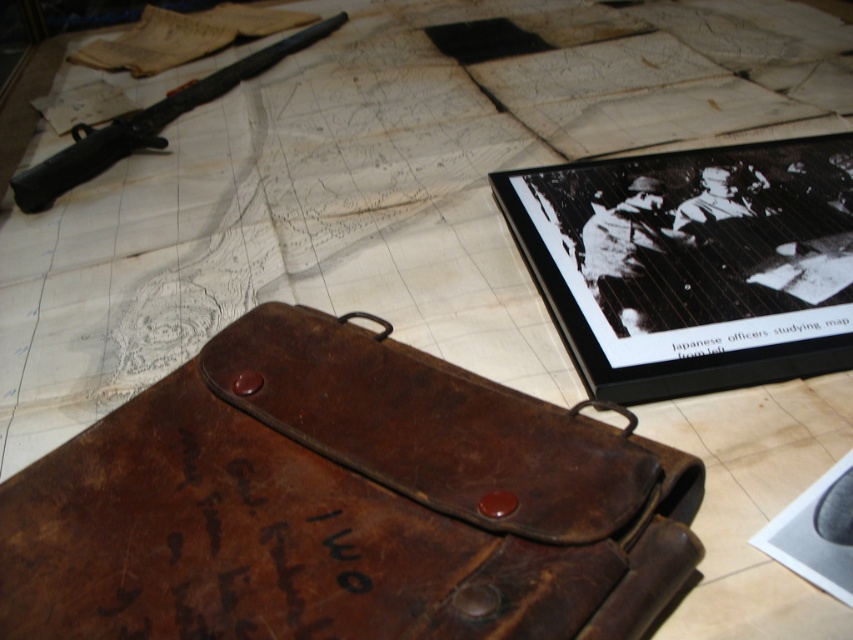
You are a visitor standing at the entrance of the museum exhibit. You see two points marked on the display case. The first point is at coordinate point (44,522) and the second is at point (90,156). Which point is closer to you?

Point (44,522) is in front of point (90,156), so it is closer to you.

What is the point at coordinate [341,504] located on?

The point at coordinate [341,504] is located on the leather case at center.